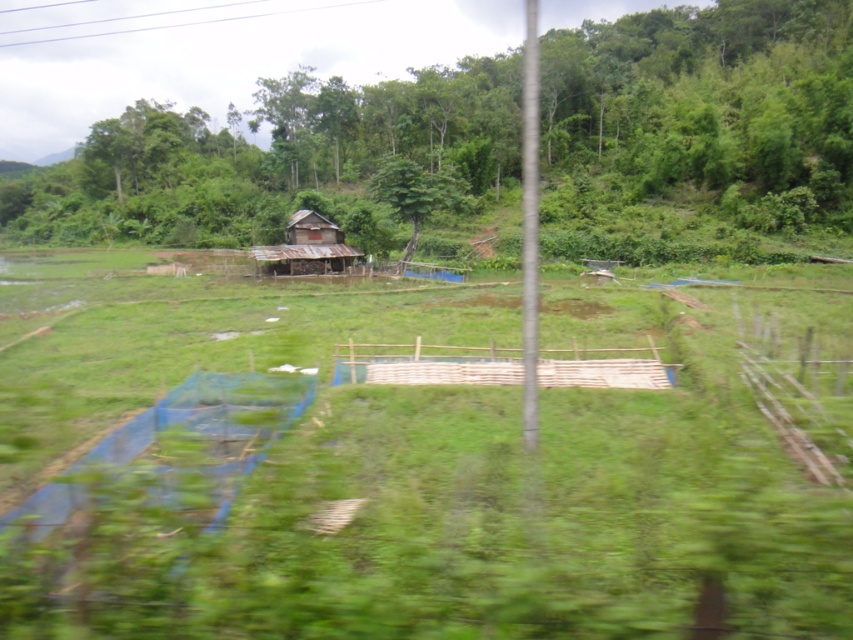
Which is above, green grass at center or green leafy tree at center?

green leafy tree at center is higher up.

Between point (254, 388) and point (831, 202), which one is positioned behind?

Point (831, 202)

You are a GUI agent. You are given a task and a screenshot of the screen. Output one action in this format:
    pyautogui.click(x=<x>, y=<y>)
    Task: Click on the green grass at center
    
    Given the screenshot: What is the action you would take?
    pyautogui.click(x=422, y=476)

Is green grass at center wider than rusty wood hut at center?

Yes.

Who is more forward, (706,323) or (329,244)?

Point (706,323) is in front.

The width and height of the screenshot is (853, 640). Identify the location of green grass at center. (422, 476).

Between green leafy tree at center and rusty wood hut at center, which one has less height?

rusty wood hut at center is shorter.

Is green leafy tree at center wider than rusty wood hut at center?

Yes.

Image resolution: width=853 pixels, height=640 pixels. Find the location of `green leafy tree at center`. green leafy tree at center is located at coordinates (699, 122).

In order to click on green leafy tree at center in this screenshot , I will do 699,122.